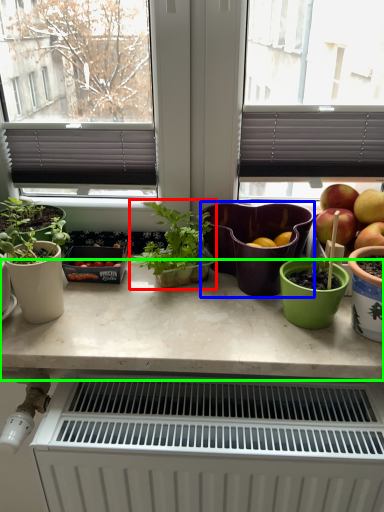
Question: Estimate the real-world distances between objects in this image. Which object is farther from houseplant (highlighted by a red box), flowerpot (highlighted by a blue box) or countertop (highlighted by a green box)?

Choices:
 (A) flowerpot
 (B) countertop

Answer: (B)